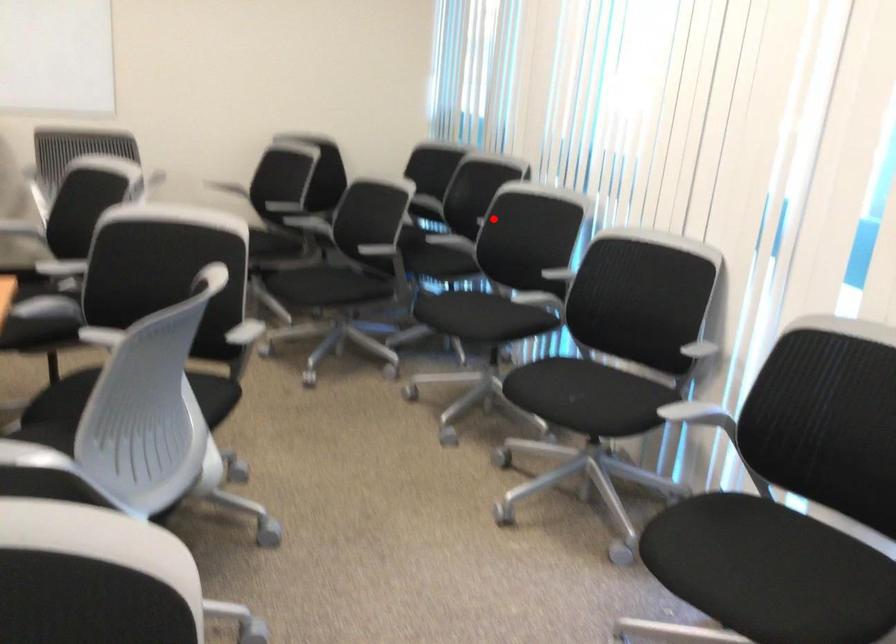
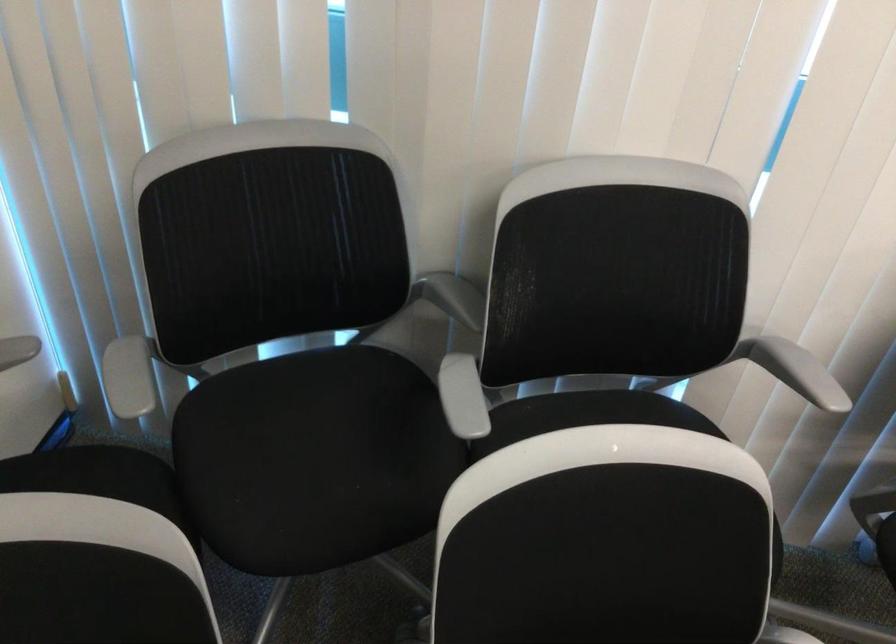
Find the pixel in the second image that matches the highlighted location in the first image.

(794, 370)